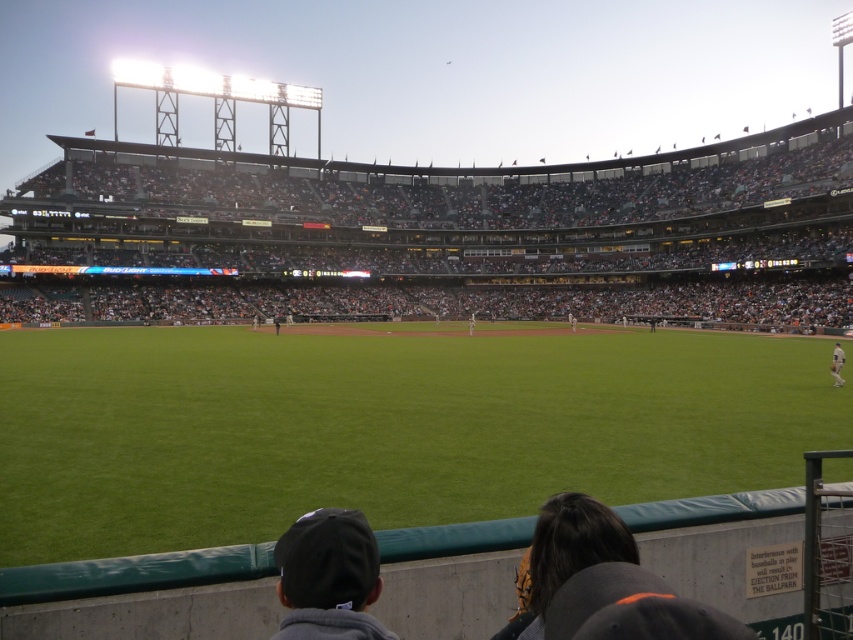
Is green grass at center shorter than white jersey at center?

In fact, green grass at center may be taller than white jersey at center.

Who is positioned more to the left, green grass at center or white jersey at center?

green grass at center

Is point (251, 380) positioned before point (831, 360)?

Yes.

The height and width of the screenshot is (640, 853). Identify the location of green grass at center. (381, 428).

Does dark gray fabric cap at lower center appear under white uniform at center?

Correct, dark gray fabric cap at lower center is located below white uniform at center.

Looking at this image, is dark gray fabric cap at lower center further to camera compared to white uniform at center?

No, it is not.

Which is in front, point (283, 545) or point (471, 332)?

Point (283, 545) is more forward.

At what (x,y) coordinates should I click in order to perform the action: click on dark gray fabric cap at lower center. Please return your answer as a coordinate pair (x, y). This screenshot has height=640, width=853. Looking at the image, I should click on (328, 577).

Between green grass at center and white uniform at center, which one appears on the right side from the viewer's perspective?

Positioned to the right is white uniform at center.

Looking at this image, does green grass at center appear on the right side of white uniform at center?

Incorrect, green grass at center is not on the right side of white uniform at center.

Where is `green grass at center`? The width and height of the screenshot is (853, 640). green grass at center is located at coordinates pyautogui.click(x=381, y=428).